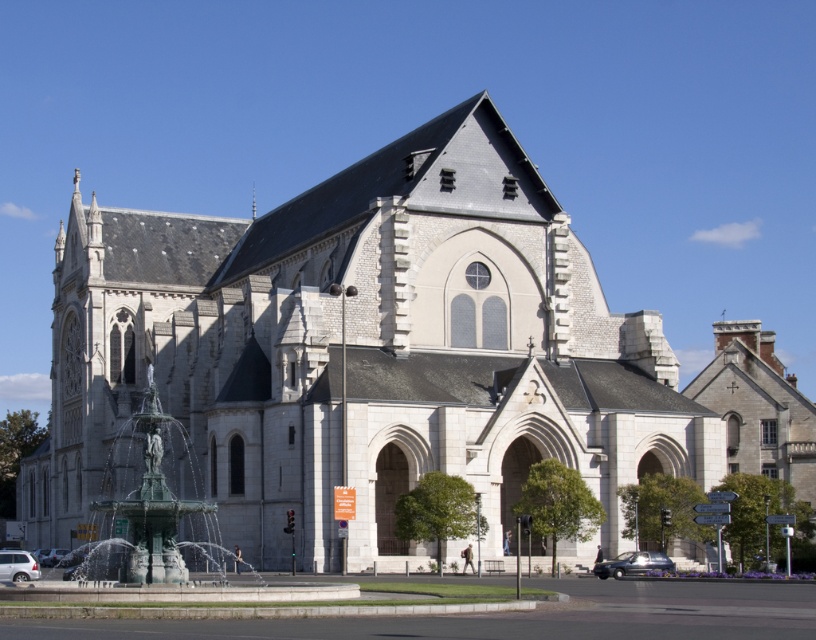
Looking at this image, does white stone church at center lie in front of green patinated bronze fountain at lower left?

No, it is behind green patinated bronze fountain at lower left.

Does white stone church at center have a smaller size compared to green patinated bronze fountain at lower left?

Actually, white stone church at center might be larger than green patinated bronze fountain at lower left.

Image resolution: width=816 pixels, height=640 pixels. What do you see at coordinates (358, 349) in the screenshot? I see `white stone church at center` at bounding box center [358, 349].

You are a GUI agent. You are given a task and a screenshot of the screen. Output one action in this format:
    pyautogui.click(x=<x>, y=<y>)
    Task: Click on the white stone church at center
    The width and height of the screenshot is (816, 640).
    Given the screenshot: What is the action you would take?
    pyautogui.click(x=358, y=349)

Measure the distance from green patinated bronze fountain at lower left to silver metallic car at lower left.

green patinated bronze fountain at lower left and silver metallic car at lower left are 9.05 meters apart from each other.

Between green patinated bronze fountain at lower left and silver metallic car at lower left, which one appears on the right side from the viewer's perspective?

Positioned to the right is green patinated bronze fountain at lower left.

Who is more forward, (200, 486) or (27, 563)?

Point (27, 563)

This screenshot has height=640, width=816. In order to click on green patinated bronze fountain at lower left in this screenshot , I will do `click(151, 502)`.

Can you confirm if shiny black sedan at lower right is bigger than silver metallic car at lower left?

No.

Does shiny black sedan at lower right come in front of silver metallic car at lower left?

No, shiny black sedan at lower right is behind silver metallic car at lower left.

Between point (615, 577) and point (30, 572), which one is positioned behind?

The point (615, 577) is more distant.

Locate an element on the screen. This screenshot has height=640, width=816. shiny black sedan at lower right is located at coordinates (632, 563).